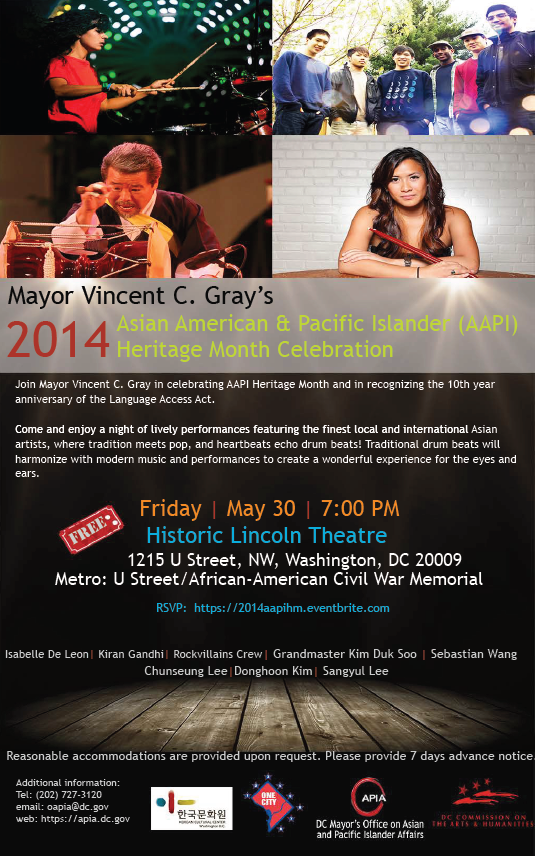
This screenshot has width=535, height=856. I want to click on green lights, so click(146, 10).